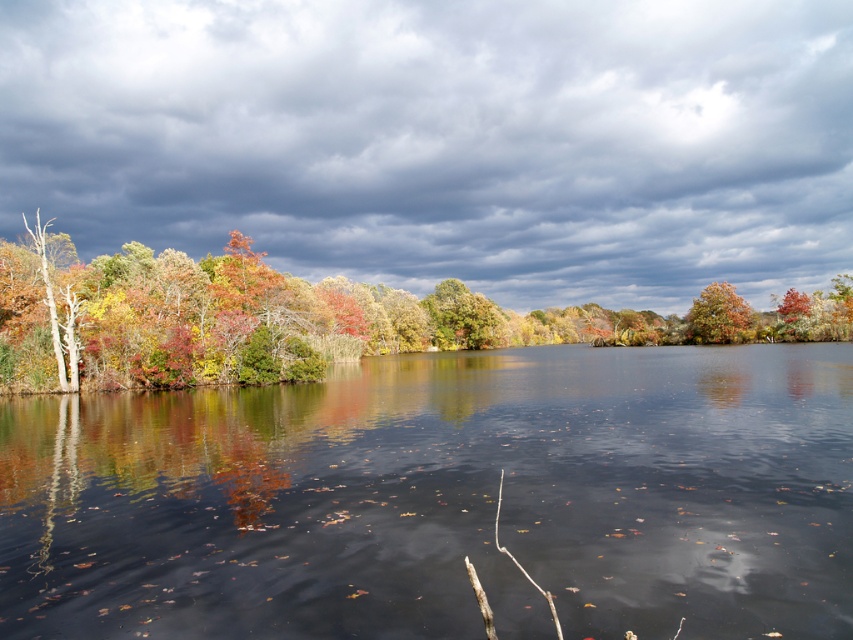
You are standing at the lakeside and want to take a photo of the smooth reflective water at center and autumn foliage at left. Which object should you focus on first if you want to capture both in one frame?

The smooth reflective water at center is below autumn foliage at left, so you should focus on the autumn foliage at left first to ensure both are in the frame.